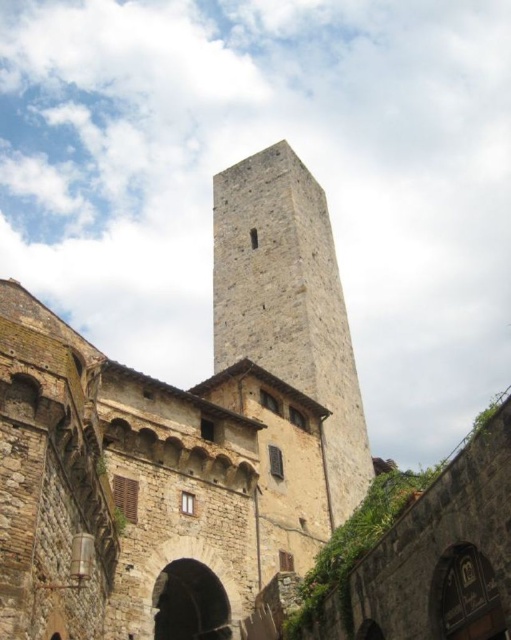
Question: Which of the following is the farthest from the observer?

Choices:
 (A) stone tower at center
 (B) gray stone tower at center

Answer: (B)

Question: Among these points, which one is farthest from the camera?

Choices:
 (A) (316, 204)
 (B) (219, 416)

Answer: (A)

Question: Is stone tower at center to the right of gray stone tower at center from the viewer's perspective?

Choices:
 (A) yes
 (B) no

Answer: (B)

Question: Does stone tower at center have a larger size compared to gray stone tower at center?

Choices:
 (A) yes
 (B) no

Answer: (A)

Question: Which point is closer to the camera?

Choices:
 (A) gray stone tower at center
 (B) stone tower at center

Answer: (B)

Question: Does stone tower at center appear under gray stone tower at center?

Choices:
 (A) yes
 (B) no

Answer: (A)